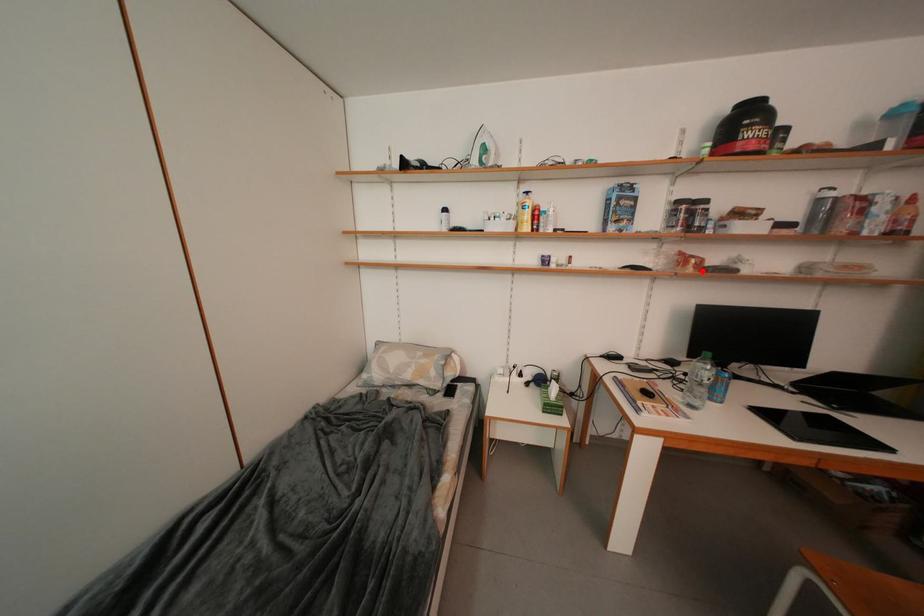
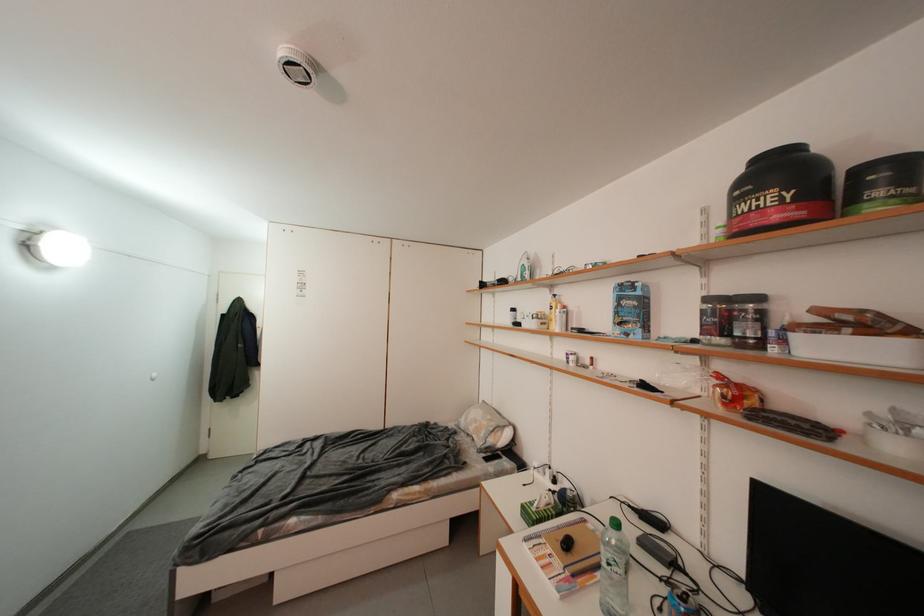
Where in the second image is the point corresponding to the highlighted location from the first image?

(733, 408)